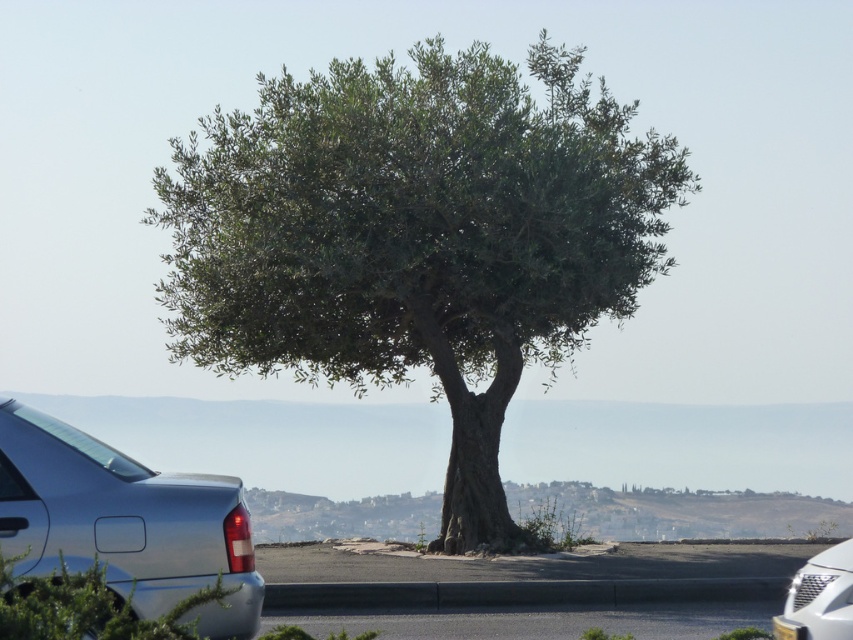
You are a photographer trying to capture both the satin metallic car at lower left and the silver metallic car at lower right in a single shot. Based on their positions, which car would appear larger in the photo?

The satin metallic car at lower left appears larger in the photo because it is closer to the viewer than the silver metallic car at lower right.

You are standing at the point marked as point (416, 237) in the image. What object is directly in front of you?

The green leafy tree at center is directly in front of you at point (416, 237).